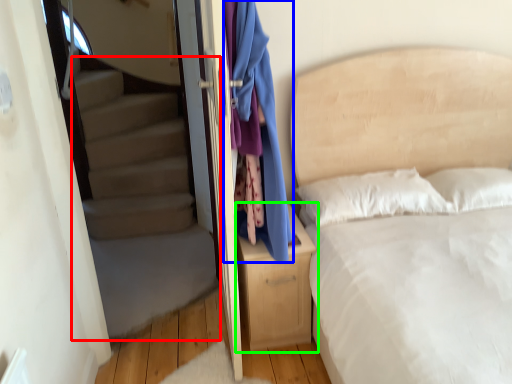
Question: Which object is positioned farthest from stairwell (highlighted by a red box)? Select from clothing (highlighted by a blue box) and nightstand (highlighted by a green box).

Choices:
 (A) clothing
 (B) nightstand

Answer: (A)